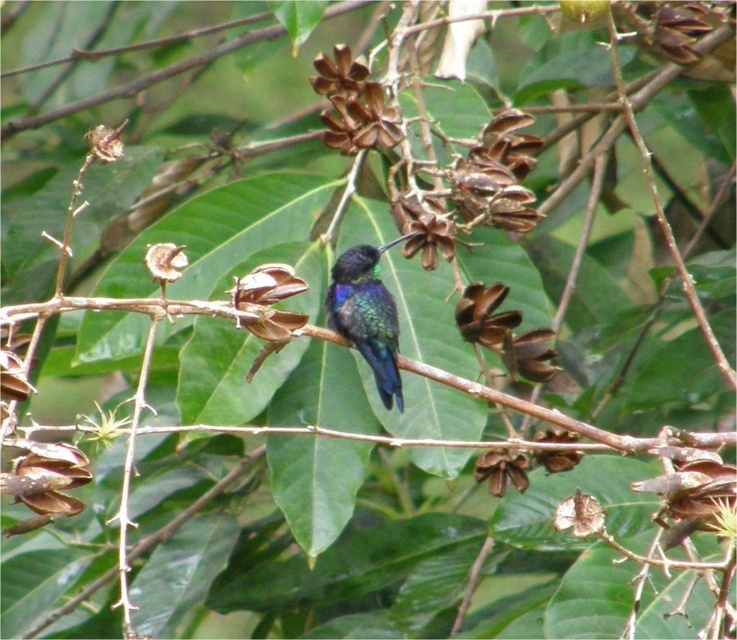
Does point (380, 128) lie behind point (113, 157)?

Yes, point (380, 128) is behind point (113, 157).

Can you confirm if brown matte pod at upper center is bigger than greenish-brown dried pod at upper left?

Yes.

Which is in front, point (356, 93) or point (102, 140)?

Point (102, 140) is more forward.

This screenshot has height=640, width=737. Find the location of `brown matte pod at upper center`. brown matte pod at upper center is located at coordinates (352, 104).

Does brown matte pod at upper center have a larger size compared to smooth white seed pod at center?

Indeed, brown matte pod at upper center has a larger size compared to smooth white seed pod at center.

Identify the location of brown matte pod at upper center. This screenshot has width=737, height=640. (352, 104).

Is point (329, 132) closer to viewer compared to point (156, 244)?

That is False.

I want to click on brown matte pod at upper center, so click(352, 104).

In the scene shown: Who is positioned more to the left, shiny iridescent bird at center or brown matte pod at upper center?

brown matte pod at upper center is more to the left.

Which is above, shiny iridescent bird at center or brown matte pod at upper center?

brown matte pod at upper center is higher up.

This screenshot has width=737, height=640. Find the location of `shiny iridescent bird at center`. shiny iridescent bird at center is located at coordinates (366, 316).